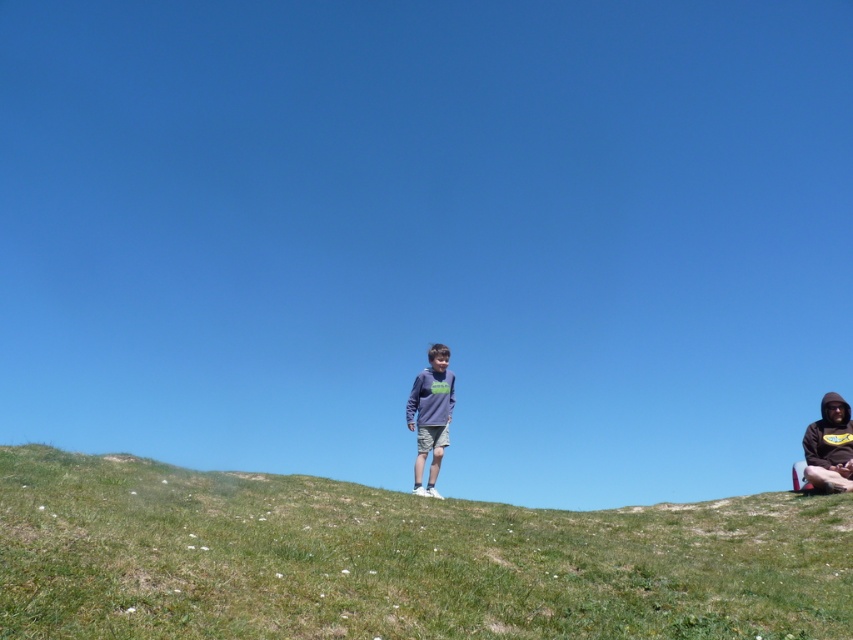
You are standing at point A and want to walk to point B. The coordinates for point A are point A is at (445, 506) and point B is at (840, 435). According to the scene, which direction should you face to move towards point B?

You should face towards the upper left direction because point A is in front of point B, meaning point B is behind point A in the scene. Since moving from A to B requires going backward relative to your current facing direction, you need to turn around and face the opposite direction, which would be upper left.

Based on the photo, you are standing at the bottom of the hill and want to climb to the top. Is the green grassy hillside at center the highest point in the scene?

The green grassy hillside at center is located at point (397, 560), which is the highest point in the scene, so yes, it is the highest point.